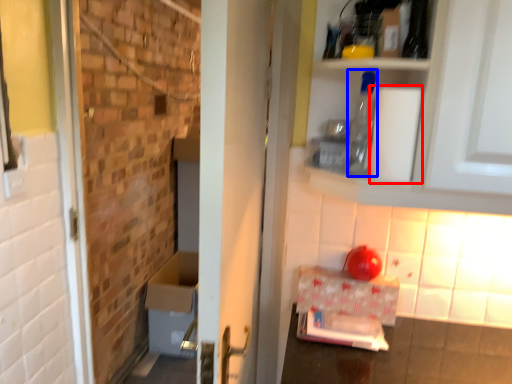
Question: Which point is further to the camera, toilet paper (highlighted by a red box) or bottle (highlighted by a blue box)?

Choices:
 (A) toilet paper
 (B) bottle

Answer: (B)